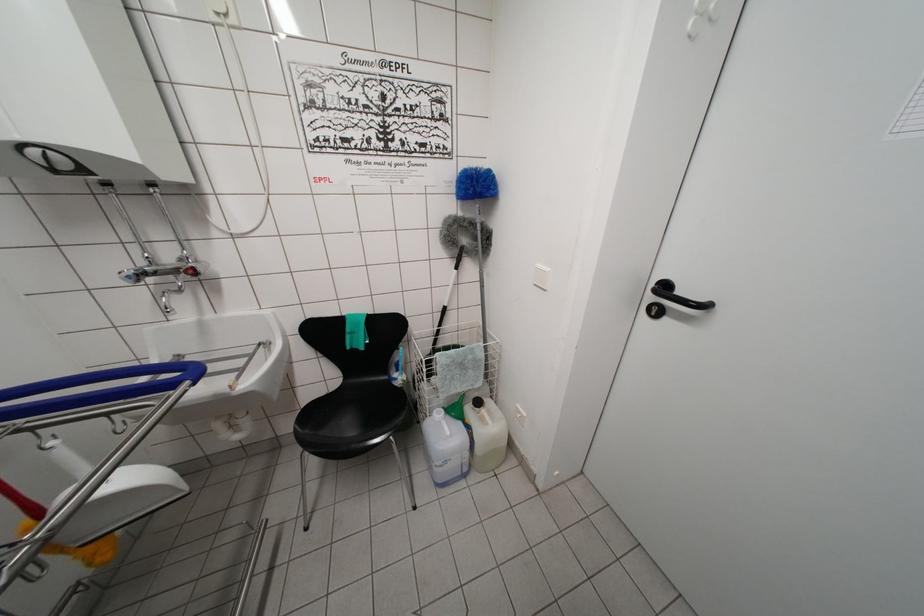
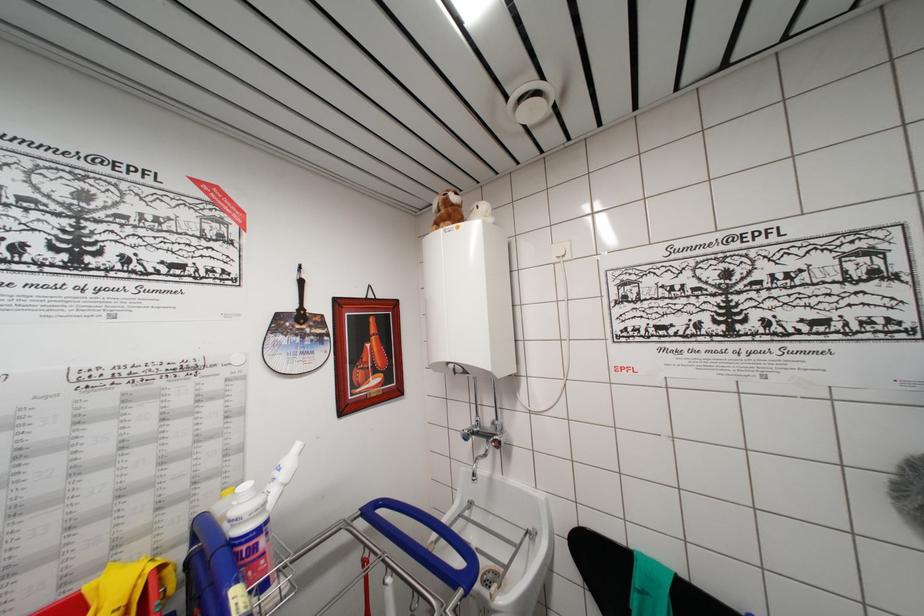
The images are taken continuously from a first-person perspective. In which direction is your viewpoint rotating?

The rotation direction of the camera is left-up.